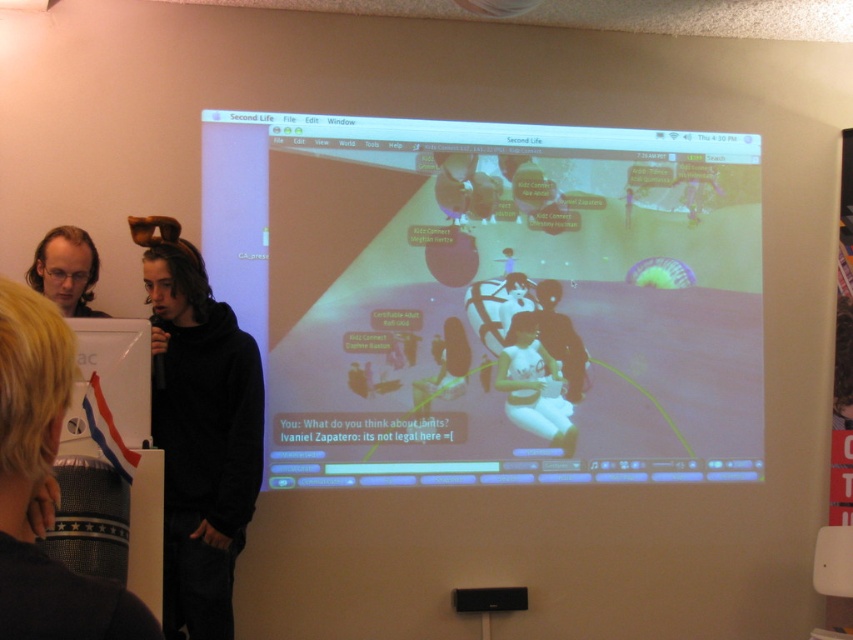
Does matte plastic screen at center have a larger size compared to white matte dress at center?

Indeed, matte plastic screen at center has a larger size compared to white matte dress at center.

Does matte plastic screen at center lie behind white matte dress at center?

No, matte plastic screen at center is in front of white matte dress at center.

Which is in front, point (666, 330) or point (527, 328)?

Point (527, 328) is in front.

The width and height of the screenshot is (853, 640). Find the location of `matte plastic screen at center`. matte plastic screen at center is located at coordinates (491, 298).

Is blonde hair at lower left positioned at the back of matte black hair at upper left?

No.

Does blonde hair at lower left have a lesser width compared to matte black hair at upper left?

In fact, blonde hair at lower left might be wider than matte black hair at upper left.

Does point (70, 625) come behind point (90, 266)?

No, it is in front of (90, 266).

The image size is (853, 640). I want to click on blonde hair at lower left, so click(44, 486).

Can you confirm if matte plastic screen at center is shorter than blonde hair at lower left?

Incorrect, matte plastic screen at center's height does not fall short of blonde hair at lower left's.

Which is above, matte plastic screen at center or blonde hair at lower left?

Positioned higher is matte plastic screen at center.

Is point (541, 346) positioned before point (59, 618)?

That is False.

Locate an element on the screen. The image size is (853, 640). matte plastic screen at center is located at coordinates (491, 298).